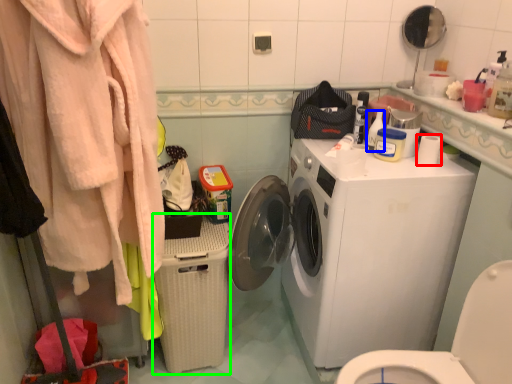
Question: Which object is positioned closest to toilet paper (highlighted by a red box)? Select from cleaning product (highlighted by a blue box) and dish washer (highlighted by a green box).

Choices:
 (A) cleaning product
 (B) dish washer

Answer: (A)